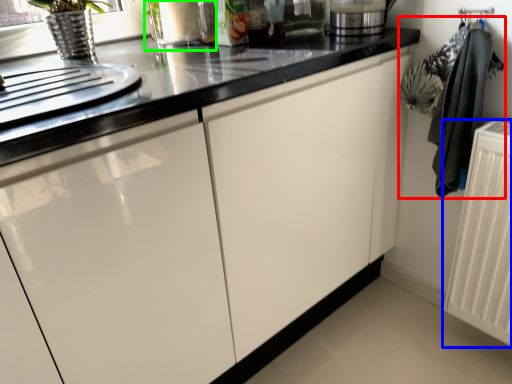
Question: Which object is positioned closest to laundry (highlighted by a red box)? Select from radiator (highlighted by a blue box) and appliance (highlighted by a green box).

Choices:
 (A) radiator
 (B) appliance

Answer: (A)